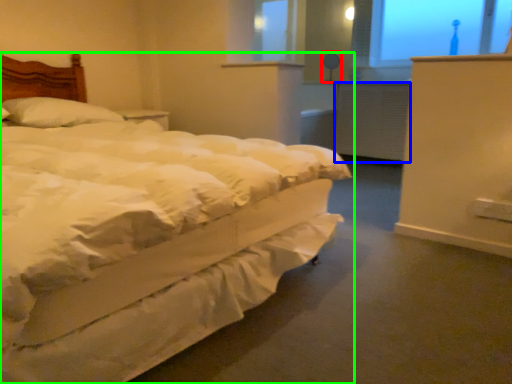
Question: Which object is positioned closest to table lamp (highlighted by a red box)? Select from radiator (highlighted by a blue box) and bed (highlighted by a green box).

Choices:
 (A) radiator
 (B) bed

Answer: (A)